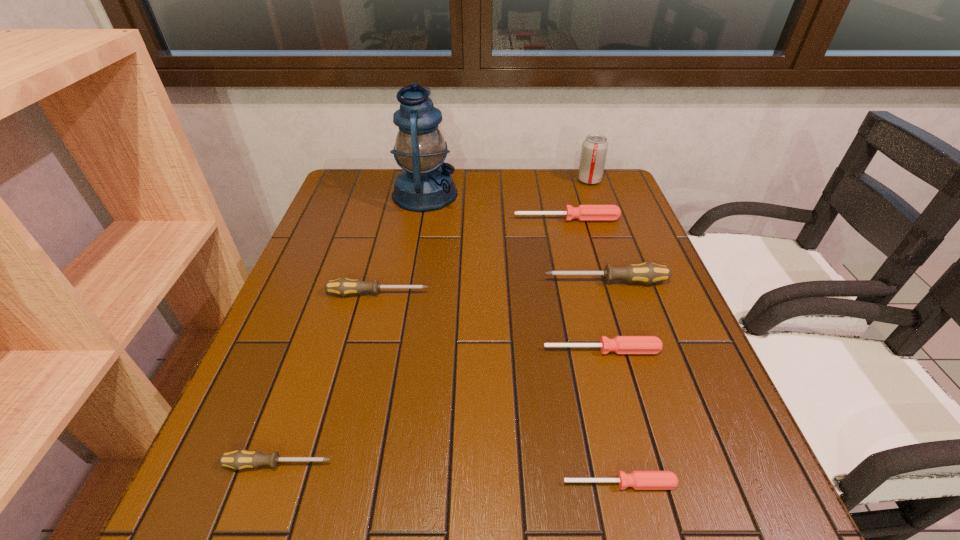
At what (x,y) coordinates should I click in order to perform the action: click on vacant area between the seventh shortest object and the farthest red screwdriver. Please return your answer as a coordinate pair (x, y). This screenshot has width=960, height=540. Looking at the image, I should click on (578, 200).

Identify the location of vacant space that's between the second smallest gray screwdriver and the blue lantern. Image resolution: width=960 pixels, height=540 pixels. 401,244.

Find the location of `empty space between the biggest gray screwdriver and the biggest red screwdriver`. empty space between the biggest gray screwdriver and the biggest red screwdriver is located at coordinates (587, 250).

Where is `free space between the fourth farthest screwdriver and the nearest red screwdriver`? free space between the fourth farthest screwdriver and the nearest red screwdriver is located at coordinates (611, 417).

You are a GUI agent. You are given a task and a screenshot of the screen. Output one action in this format:
    pyautogui.click(x=<x>, y=<y>)
    Task: Click on the free space between the second nearest red screwdriver and the seventh farthest object
    The width and height of the screenshot is (960, 540).
    Given the screenshot: What is the action you would take?
    pyautogui.click(x=440, y=407)

Find the location of a particular element. This screenshot has height=540, width=960. vacant point located between the smallest gray screwdriver and the second smallest gray screwdriver is located at coordinates (327, 379).

Choose which object is the third nearest neighbor to the blue lantern. Please provide its 2D coordinates. Your answer should be formatted as a tuple, i.e. [(x, y)], where the tuple contains the x and y coordinates of a point satisfying the conditions above.

[(647, 272)]

Select which object appears as the seventh closest to the tallest screwdriver. Please provide its 2D coordinates. Your answer should be formatted as a tuple, i.e. [(x, y)], where the tuple contains the x and y coordinates of a point satisfying the conditions above.

[(239, 459)]

I want to click on the second closest screwdriver relative to the soda can, so [647, 272].

What are the coordinates of `screwdriver that stands as the closest to the soda can` in the screenshot? It's located at (583, 212).